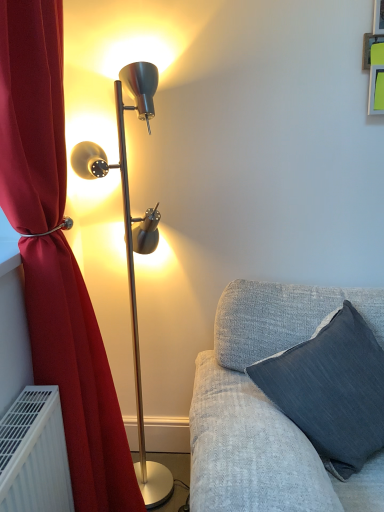
Question: From the image's perspective, is metallic gold floor lamp at left under velvet red curtain at left?

Choices:
 (A) no
 (B) yes

Answer: (A)

Question: Would you say metallic gold floor lamp at left is outside velvet red curtain at left?

Choices:
 (A) yes
 (B) no

Answer: (A)

Question: Considering the relative sizes of metallic gold floor lamp at left and velvet red curtain at left in the image provided, is metallic gold floor lamp at left thinner than velvet red curtain at left?

Choices:
 (A) no
 (B) yes

Answer: (B)

Question: From a real-world perspective, is metallic gold floor lamp at left located higher than velvet red curtain at left?

Choices:
 (A) yes
 (B) no

Answer: (B)

Question: Can you confirm if metallic gold floor lamp at left is shorter than velvet red curtain at left?

Choices:
 (A) no
 (B) yes

Answer: (B)

Question: Is metallic gold floor lamp at left positioned in front of velvet red curtain at left?

Choices:
 (A) yes
 (B) no

Answer: (B)

Question: Is dark gray fabric pillow at lower right positioned before velvet red curtain at left?

Choices:
 (A) yes
 (B) no

Answer: (B)

Question: From a real-world perspective, is dark gray fabric pillow at lower right physically above velvet red curtain at left?

Choices:
 (A) no
 (B) yes

Answer: (A)

Question: Does dark gray fabric pillow at lower right have a larger size compared to velvet red curtain at left?

Choices:
 (A) yes
 (B) no

Answer: (B)

Question: Can you confirm if dark gray fabric pillow at lower right is thinner than velvet red curtain at left?

Choices:
 (A) no
 (B) yes

Answer: (A)

Question: Is dark gray fabric pillow at lower right looking in the opposite direction of velvet red curtain at left?

Choices:
 (A) yes
 (B) no

Answer: (B)

Question: Is dark gray fabric pillow at lower right positioned beyond the bounds of velvet red curtain at left?

Choices:
 (A) yes
 (B) no

Answer: (A)

Question: Considering the relative positions of velvet red curtain at left and dark gray fabric pillow at lower right in the image provided, is velvet red curtain at left behind dark gray fabric pillow at lower right?

Choices:
 (A) yes
 (B) no

Answer: (B)